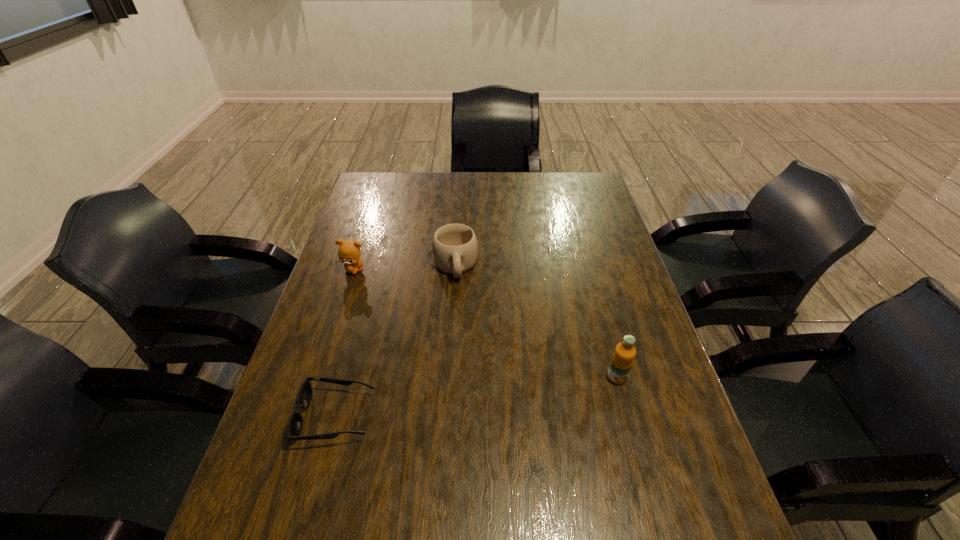
Find the location of a particular element. vacant spot on the desktop that is between the sunglasses and the rightmost object and is positioned on the side of the third object from left to right with the handle is located at coordinates (469, 397).

The height and width of the screenshot is (540, 960). I want to click on free space on the desktop that is between the shortest object and the rightmost object and is positioned on the face of the teddy bear, so click(491, 395).